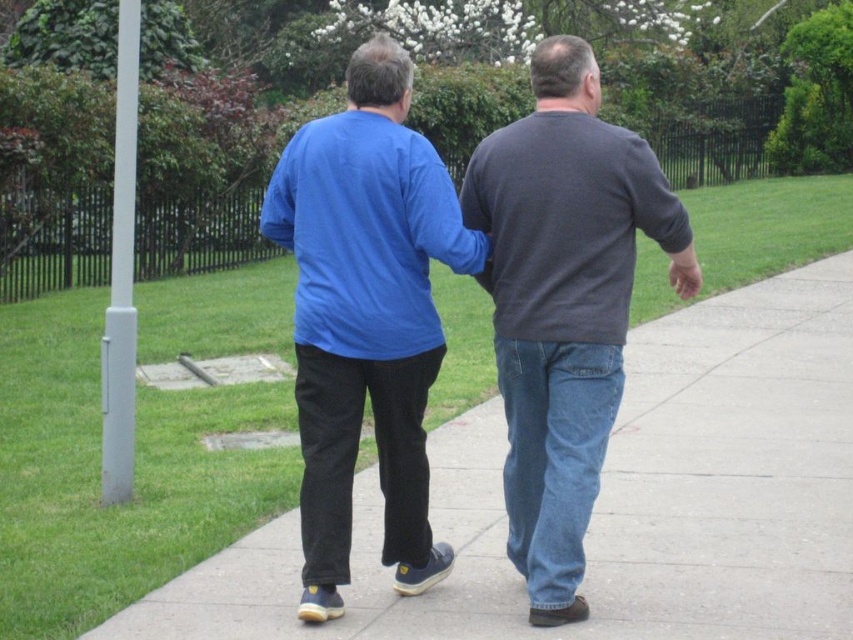
You are standing at the camera position and want to reach the point at coordinates [379,93]. The sidewalk is 10 feet wide. Can you walk straight ahead to reach the point without crossing the sidewalk?

The point at coordinates [379,93] is 16.05 feet away from the camera. Since the sidewalk is 10 feet wide, walking straight ahead would take you to the edge of the sidewalk at 10 feet, but the point is further away at 16.05 feet. Therefore, you can continue walking straight ahead past the sidewalk edge to reach the point, but you would need to leave the sidewalk.

From the picture: You are standing at the camera position and want to reach the point marked as point (779, 310). If your walking speed is 3 feet per second, how many seconds will it take you to reach that point?

The point (779, 310) is 38.18 feet away from the camera. At a speed of 3 feet per second, it would take 38.18 divided by 3, which is approximately 12.73 seconds to reach the point.

You are standing at the starting point and see the concrete sidewalk at center and the dark gray sweater at center. Which object is located to the right of the other?

The concrete sidewalk at center is to the right of the dark gray sweater at center.